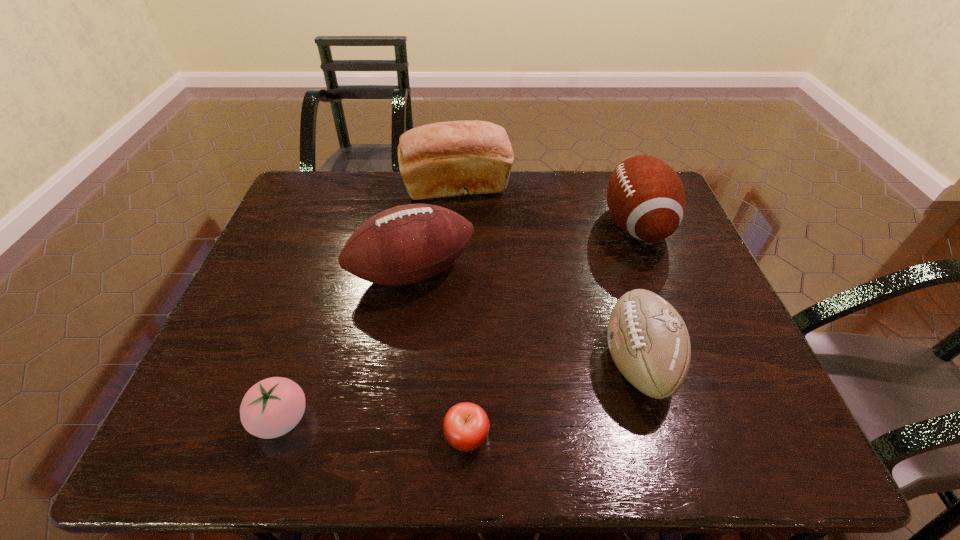
Locate an element on the screen. The width and height of the screenshot is (960, 540). bread is located at coordinates (445, 159).

At what (x,y) coordinates should I click in order to perform the action: click on the leftmost football (American). Please return your answer as a coordinate pair (x, y). This screenshot has height=540, width=960. Looking at the image, I should click on [x=406, y=244].

You are a GUI agent. You are given a task and a screenshot of the screen. Output one action in this format:
    pyautogui.click(x=<x>, y=<y>)
    Task: Click on the fourth tallest object
    Image resolution: width=960 pixels, height=540 pixels.
    Given the screenshot: What is the action you would take?
    pyautogui.click(x=648, y=340)

Locate an element on the screen. This screenshot has width=960, height=540. the nearest football (American) is located at coordinates (648, 340).

You are a GUI agent. You are given a task and a screenshot of the screen. Output one action in this format:
    pyautogui.click(x=<x>, y=<y>)
    Task: Click on the second shortest object
    The image size is (960, 540).
    Given the screenshot: What is the action you would take?
    pyautogui.click(x=272, y=407)

Image resolution: width=960 pixels, height=540 pixels. What are the coordinates of `the shortest object` in the screenshot? It's located at (466, 426).

This screenshot has height=540, width=960. Find the location of `vacant area situated 0.360m on the front of the bread`. vacant area situated 0.360m on the front of the bread is located at coordinates (450, 294).

Identify the location of free space located 0.340m on the front of the leftmost football (American). (388, 436).

At what (x,y) coordinates should I click in order to perform the action: click on free spot located on the laces of the fourth tallest object. Please return your answer as a coordinate pair (x, y). Image resolution: width=960 pixels, height=540 pixels. Looking at the image, I should click on (448, 361).

The height and width of the screenshot is (540, 960). Find the location of `vacant space located on the laces of the fourth tallest object`. vacant space located on the laces of the fourth tallest object is located at coordinates (420, 361).